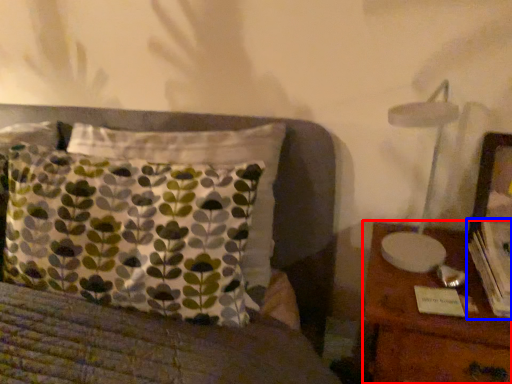
Question: Among these objects, which one is nearest to the camera, nightstand (highlighted by a red box) or book (highlighted by a blue box)?

Choices:
 (A) nightstand
 (B) book

Answer: (A)